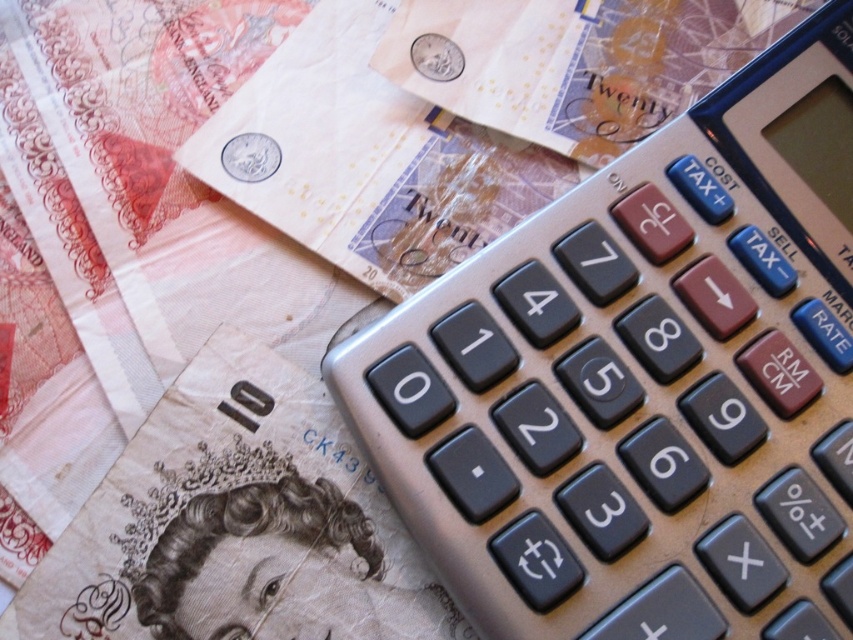
Question: Can you confirm if silver/black calculator at upper right is thinner than light brown paper at center?

Choices:
 (A) yes
 (B) no

Answer: (B)

Question: Among these points, which one is farthest from the camera?

Choices:
 (A) (810, 440)
 (B) (149, 492)

Answer: (B)

Question: Is silver/black calculator at upper right positioned in front of light brown paper at center?

Choices:
 (A) yes
 (B) no

Answer: (A)

Question: Is silver/black calculator at upper right positioned in front of light brown paper at center?

Choices:
 (A) no
 (B) yes

Answer: (B)

Question: Which of the following is the closest to the observer?

Choices:
 (A) silver/black calculator at upper right
 (B) light brown paper at center

Answer: (A)